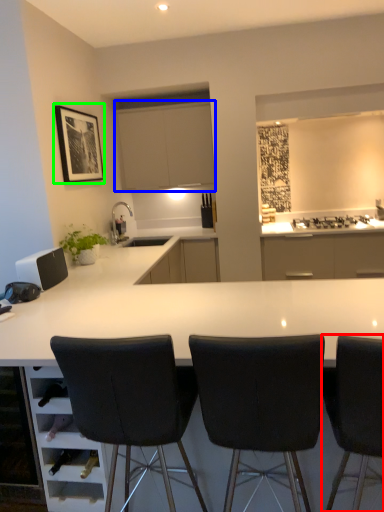
Question: Estimate the real-world distances between objects in this image. Which object is closer to chair (highlighted by a red box), cabinetry (highlighted by a blue box) or picture frame (highlighted by a green box)?

Choices:
 (A) cabinetry
 (B) picture frame

Answer: (B)